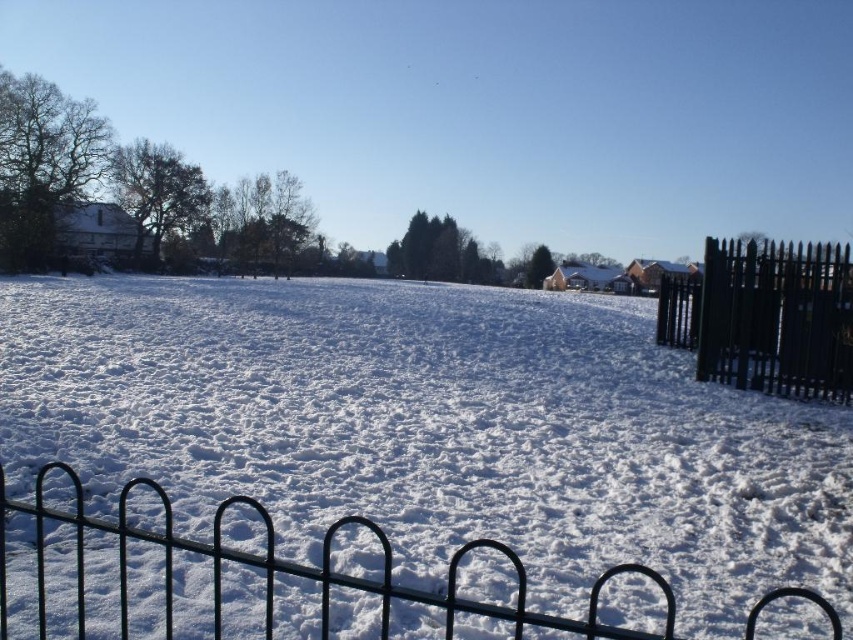
You are planning to build a snowman using the white fluffy snow at center. However, you need to cross the black metal fence at lower center to reach it. If the fence is 1.2 meters wide, can you safely step over it without falling?

The white fluffy snow at center might be wider than black metal fence at lower center, but the fence is only 1.2 meters wide. Since the snow area is possibly wider, you can safely step over the fence to reach the white fluffy snow at center as long as you aim for the center area which is wider than the fence.

You are standing in the snowy landscape and want to walk from point A to point B. Point A is at coordinates point [764,259] and point B is at point [213,538]. Considering the scene description, which point is closer to you when you start walking?

Point A at coordinates point [764,259] is closer to you than point B at point [213,538] because it is further to the viewer, meaning it is physically nearer in the scene.